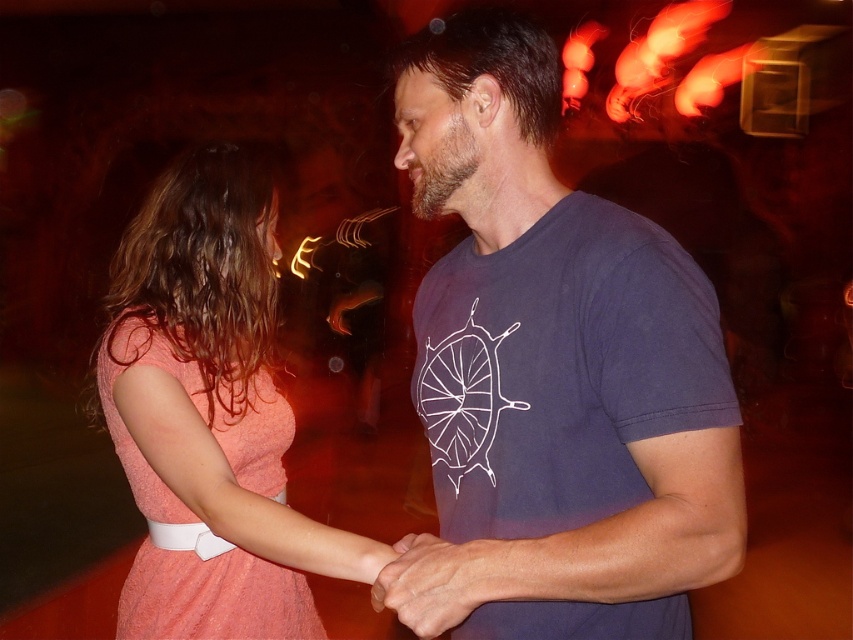
Question: Is matte coral dress at center wider than coral fabric dress at left?

Choices:
 (A) yes
 (B) no

Answer: (A)

Question: Which point is farther to the camera?

Choices:
 (A) (142, 477)
 (B) (178, 600)
 (C) (436, 611)

Answer: (A)

Question: Where is dark blue t-shirt at center located in relation to matte coral dress at center in the image?

Choices:
 (A) right
 (B) left

Answer: (A)

Question: Which point appears farthest from the camera in this image?

Choices:
 (A) (689, 435)
 (B) (210, 540)

Answer: (B)

Question: Does dark blue t-shirt at center appear under matte coral dress at center?

Choices:
 (A) no
 (B) yes

Answer: (A)

Question: Estimate the real-world distances between objects in this image. Which object is farther from the dark blue t-shirt at center?

Choices:
 (A) matte coral dress at center
 (B) coral fabric dress at left

Answer: (B)